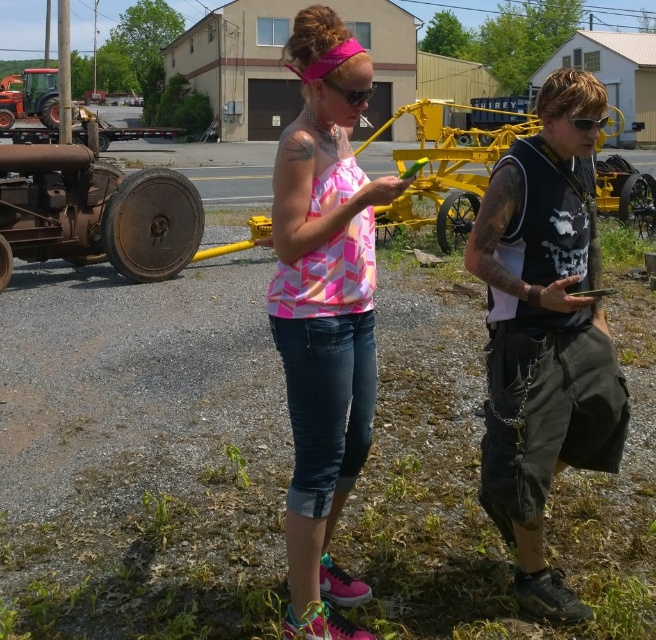
Question: Is dark gray cargo pants at center thinner than pink printed tank top at center?

Choices:
 (A) no
 (B) yes

Answer: (A)

Question: Among these points, which one is nearest to the camera?

Choices:
 (A) (586, 116)
 (B) (544, 115)
 (C) (340, 323)

Answer: (C)

Question: Based on their relative distances, which object is farther from the pink rubber goggles at center?

Choices:
 (A) black plastic goggles at center
 (B) pink printed tank top at center
 (C) dark gray cargo pants at center

Answer: (B)

Question: Is dark gray cargo pants at center positioned behind black plastic goggles at center?

Choices:
 (A) no
 (B) yes

Answer: (A)

Question: Is pink printed tank top at center below black plastic goggles at center?

Choices:
 (A) yes
 (B) no

Answer: (A)

Question: Which point is farther to the camera?

Choices:
 (A) (342, 96)
 (B) (297, 500)
 (C) (583, 124)

Answer: (B)